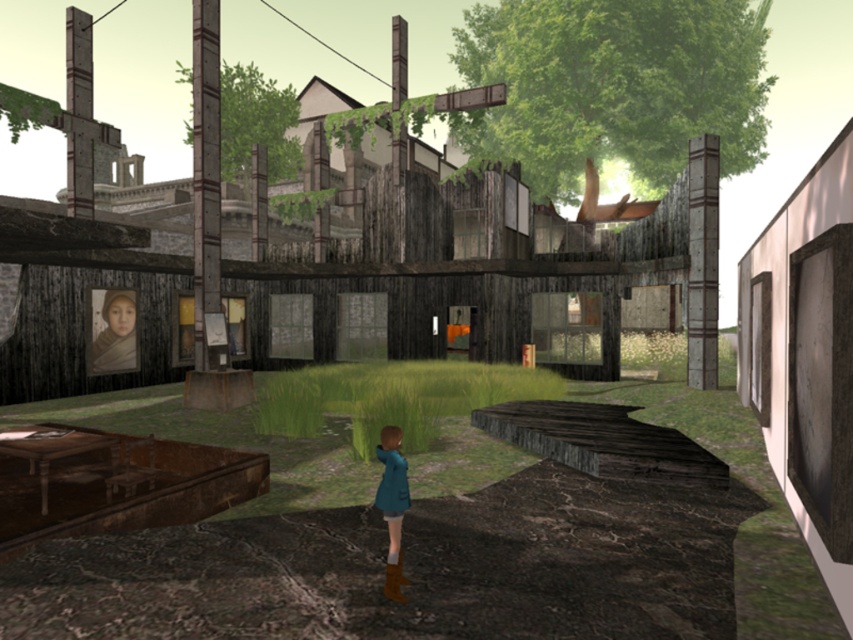
Can you confirm if matte brown hair at upper left is positioned to the left of teal fabric dress at center?

Yes, matte brown hair at upper left is to the left of teal fabric dress at center.

Which is above, matte brown hair at upper left or teal fabric dress at center?

matte brown hair at upper left

Identify the location of matte brown hair at upper left. The width and height of the screenshot is (853, 640). (115, 333).

Is point (387, 467) more distant than point (103, 340)?

That is False.

Is teal fabric coat at center above matte brown dress at upper left?

Incorrect, teal fabric coat at center is not positioned above matte brown dress at upper left.

Is point (395, 460) less distant than point (94, 355)?

Yes, point (395, 460) is closer to viewer.

The image size is (853, 640). Find the location of `teal fabric coat at center`. teal fabric coat at center is located at coordinates (392, 506).

Measure the distance between matte brown hair at upper left and matte brown dress at upper left.

A distance of 4.60 inches exists between matte brown hair at upper left and matte brown dress at upper left.

Who is positioned more to the right, matte brown hair at upper left or matte brown dress at upper left?

matte brown hair at upper left is more to the right.

Is point (120, 337) positioned behind point (106, 365)?

Yes, it is behind point (106, 365).

Find the location of a particular element. The height and width of the screenshot is (640, 853). matte brown hair at upper left is located at coordinates (115, 333).